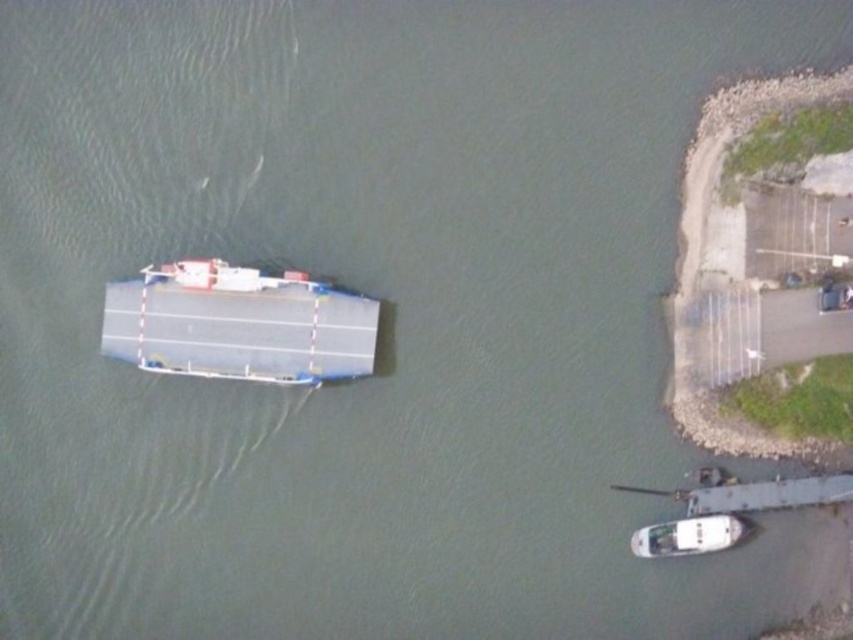
You are standing on the deck of the large boat and want to determine the distance between two specific points marked on the deck. The first point is at coordinates point (171, 321) and the second point is at point (672, 550). Given that the deck is flat and you have a measuring tape, can you determine which point is closer to you when looking straight ahead?

Point (171, 321) is further to the viewer than point (672, 550), so the point closer to you is point (672, 550).